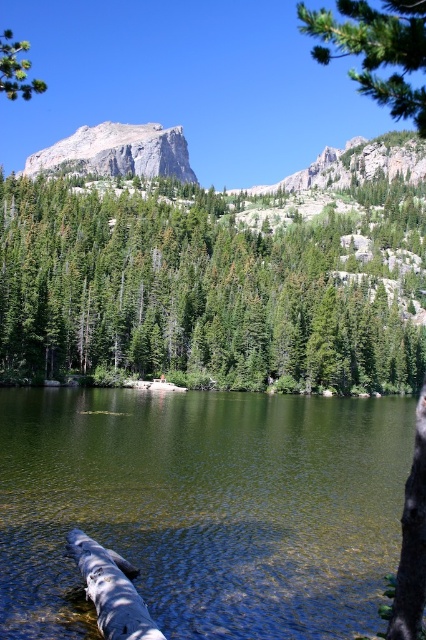
Is point (408, 76) positioned behind point (23, 90)?

No, it is in front of (23, 90).

Image resolution: width=426 pixels, height=640 pixels. Identify the location of green textured pine tree at upper right. (376, 49).

Is rugged stone mountain at upper center to the right of smooth gray log at lower left from the viewer's perspective?

In fact, rugged stone mountain at upper center is to the left of smooth gray log at lower left.

Does rugged stone mountain at upper center appear on the left side of smooth gray log at lower left?

Yes, rugged stone mountain at upper center is to the left of smooth gray log at lower left.

Which is in front, point (126, 136) or point (86, 548)?

Point (86, 548) is more forward.

Locate an element on the screen. This screenshot has height=640, width=426. rugged stone mountain at upper center is located at coordinates pos(118,152).

Which is more to the left, brown rough tree trunk at right or green leafy tree at upper left?

From the viewer's perspective, green leafy tree at upper left appears more on the left side.

This screenshot has width=426, height=640. Find the location of `brown rough tree trunk at right`. brown rough tree trunk at right is located at coordinates (411, 541).